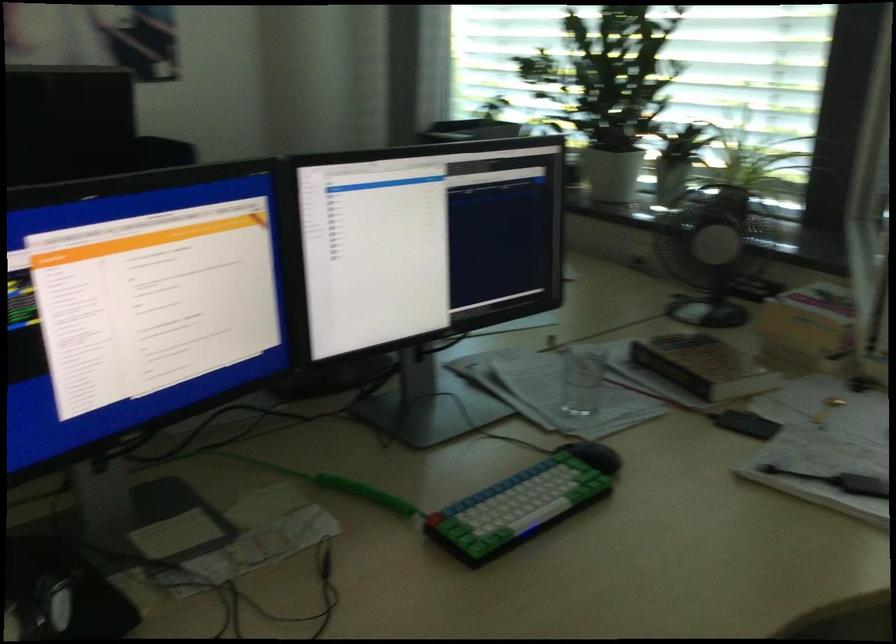
The image size is (896, 644). In order to click on brown hardcover book in this screenshot , I will do `click(703, 366)`.